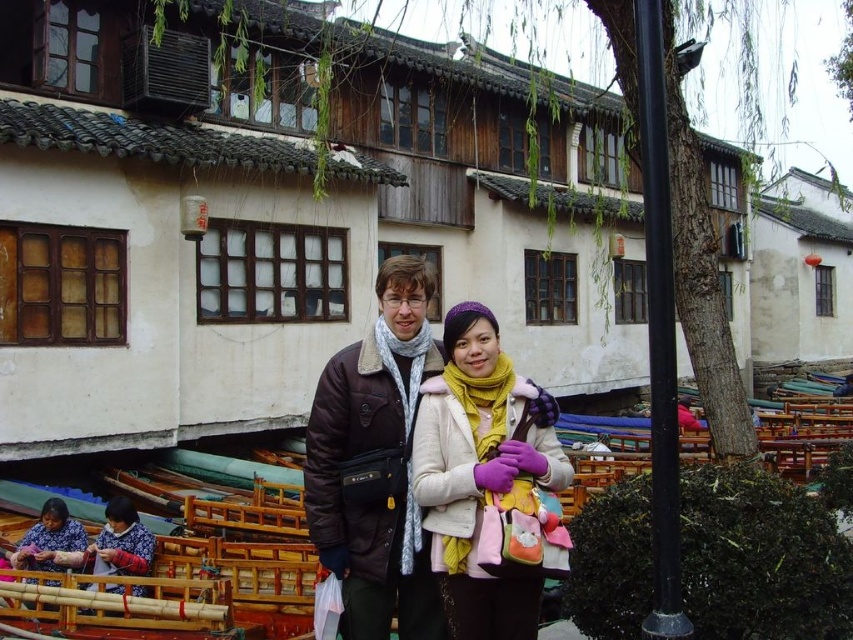
Question: Is matte white coat at center to the right of matte purple scarf at lower left from the viewer's perspective?

Choices:
 (A) yes
 (B) no

Answer: (A)

Question: Which point is farther to the camera?

Choices:
 (A) (57, 563)
 (B) (654, 276)
 (C) (395, 429)

Answer: (A)

Question: Which object is closer to the camera taking this photo?

Choices:
 (A) matte purple scarf at lower left
 (B) black metal pole at right
 (C) matte white coat at center
 (D) brown fuzzy jacket at center

Answer: (B)

Question: Does matte white coat at center appear over brown fuzzy jacket at center?

Choices:
 (A) no
 (B) yes

Answer: (A)

Question: Based on their relative distances, which object is nearer to the matte purple scarf at lower left?

Choices:
 (A) matte white coat at center
 (B) brown fuzzy jacket at center

Answer: (B)

Question: Is black metal pole at right bigger than matte purple scarf at lower left?

Choices:
 (A) yes
 (B) no

Answer: (A)